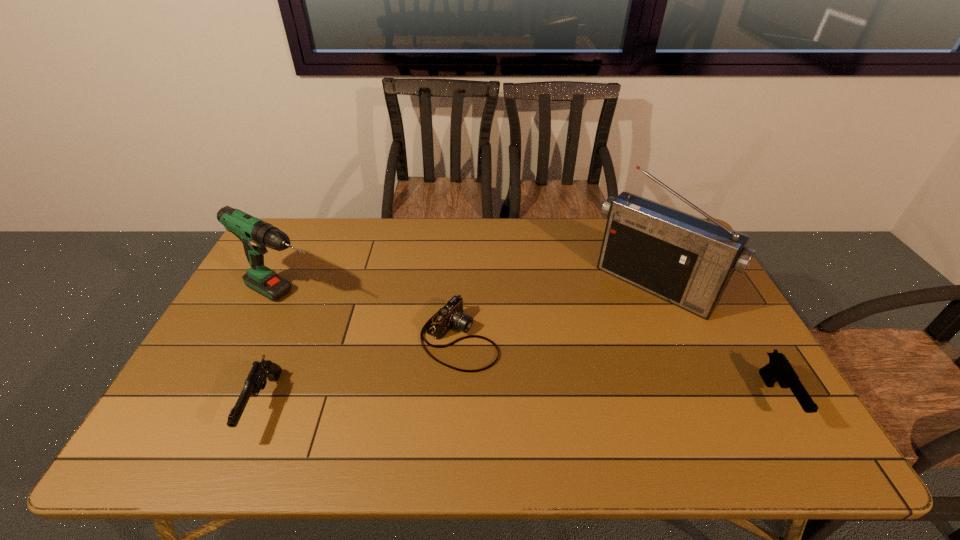
The width and height of the screenshot is (960, 540). Find the location of `gun`. gun is located at coordinates (257, 378).

At what (x,y) coordinates should I click in order to perform the action: click on pistol. Please return your answer as a coordinate pair (x, y). Looking at the image, I should click on (778, 369).

In order to click on the second tallest object in this screenshot , I will do click(255, 234).

Where is `radio receiver`? This screenshot has width=960, height=540. radio receiver is located at coordinates (685, 260).

Where is `the shortest object`? The image size is (960, 540). the shortest object is located at coordinates (450, 316).

Find the location of a particular element. The image size is (960, 540). the third object from right to left is located at coordinates (450, 316).

In order to click on free space located 0.350m on the handle side of the drill in this screenshot , I will do `click(417, 361)`.

In order to click on vacant area situated 0.280m on the handle side of the drill in this screenshot , I will do `click(396, 350)`.

This screenshot has width=960, height=540. I want to click on free space located on the handle side of the drill, so click(x=343, y=321).

Locate an element on the screen. Image resolution: width=960 pixels, height=540 pixels. vacant space located on the front-facing side of the tallest object is located at coordinates [x=568, y=382].